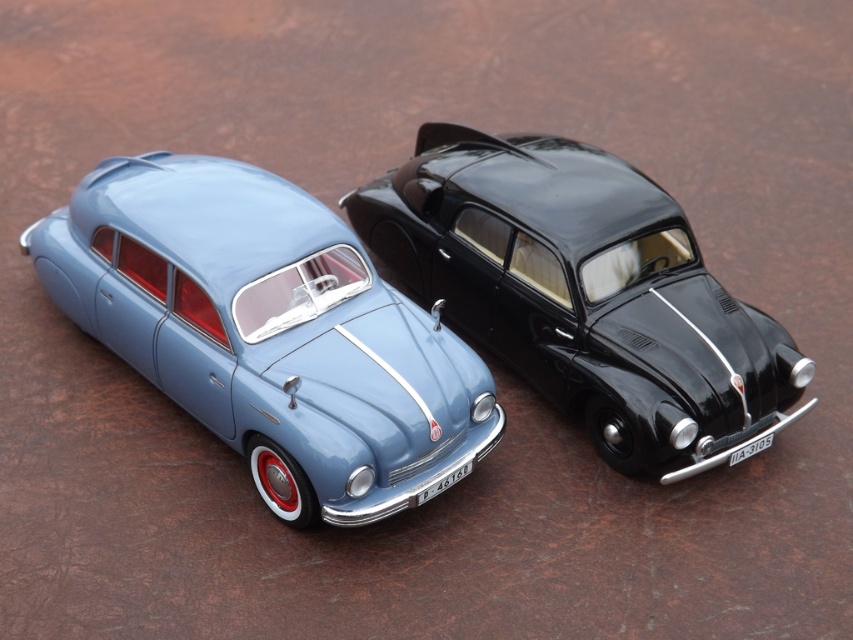
Question: Does matte blue car at center have a larger size compared to shiny black car at center?

Choices:
 (A) yes
 (B) no

Answer: (B)

Question: Which of the following is the closest to the observer?

Choices:
 (A) shiny black car at center
 (B) matte blue car at center

Answer: (B)

Question: Which object appears closest to the camera in this image?

Choices:
 (A) matte blue car at center
 (B) shiny black car at center

Answer: (A)

Question: Does matte blue car at center appear under shiny black car at center?

Choices:
 (A) yes
 (B) no

Answer: (A)

Question: Is matte blue car at center bigger than shiny black car at center?

Choices:
 (A) yes
 (B) no

Answer: (B)